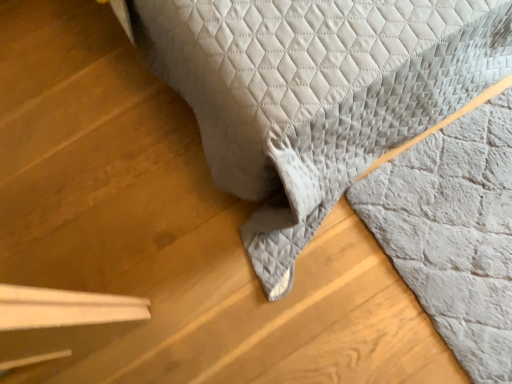
This screenshot has width=512, height=384. What do you see at coordinates (314, 93) in the screenshot?
I see `quilted fabric bed at lower right` at bounding box center [314, 93].

You are a GUI agent. You are given a task and a screenshot of the screen. Output one action in this format:
    pyautogui.click(x=<x>, y=<y>)
    Task: Click on the quilted fabric bed at lower right
    This screenshot has height=384, width=512.
    Given the screenshot: What is the action you would take?
    pyautogui.click(x=314, y=93)

What are the coordinates of `quilted fabric bed at lower right` in the screenshot? It's located at (314, 93).